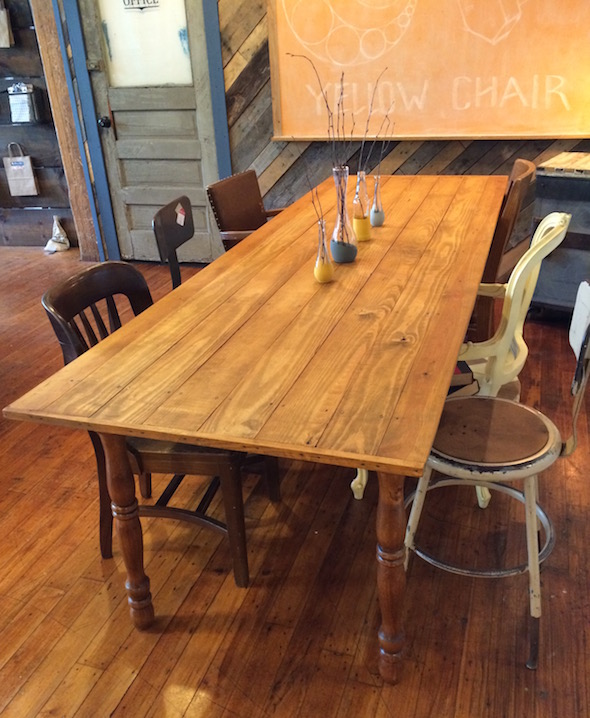
I want to click on blue paneled door frame, so click(x=225, y=128), click(x=87, y=102).